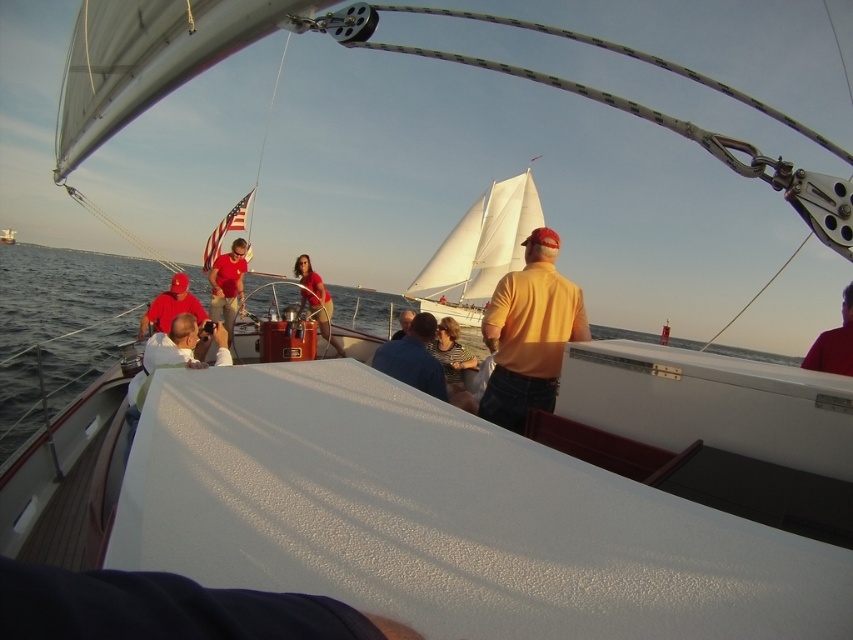
Question: Does matte red cap at center lie in front of matte red shorts at center?

Choices:
 (A) no
 (B) yes

Answer: (B)

Question: Where is blue denim shirt at center located in relation to matte red cap at center in the image?

Choices:
 (A) above
 (B) below

Answer: (B)

Question: Among these objects, which one is farthest from the camera?

Choices:
 (A) white matte boat at center
 (B) matte red cap at center
 (C) white sail at center
 (D) blue denim shirt at center

Answer: (A)

Question: Which object is positioned farthest from the matte yellow shirt at center?

Choices:
 (A) white sail at center
 (B) smooth leather jacket at upper right
 (C) matte red shorts at center
 (D) striped cotton shirt at center

Answer: (A)

Question: Which object is farther from the camera taking this photo?

Choices:
 (A) orange matte shirt at center
 (B) white matte boat at center

Answer: (B)

Question: Is matte red shorts at center positioned in front of striped cotton shirt at center?

Choices:
 (A) yes
 (B) no

Answer: (B)